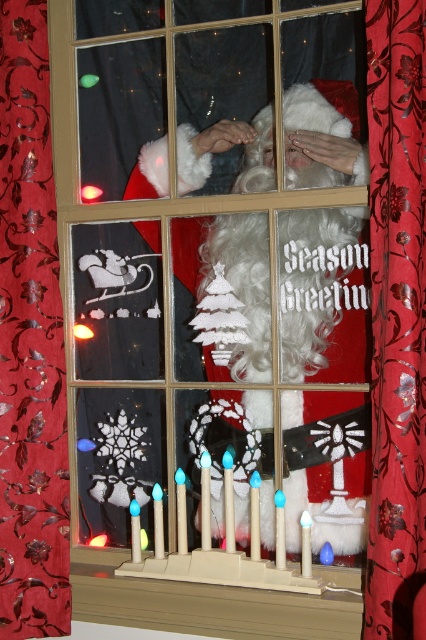
Does red floral fabric curtain at left have a lesser width compared to red velvet curtain at center?

No.

Who is positioned more to the right, red floral fabric curtain at left or red velvet curtain at center?

From the viewer's perspective, red velvet curtain at center appears more on the right side.

Is point (13, 164) positioned in front of point (409, 275)?

That is False.

Locate an element on the screen. Image resolution: width=426 pixels, height=640 pixels. red floral fabric curtain at left is located at coordinates (29, 340).

Is red velvet curtain at center below beige wood at lower center?

No.

Does point (412, 506) come behind point (238, 634)?

No.

Find the location of a particular element. red velvet curtain at center is located at coordinates (397, 317).

Is red floral fabric curtain at left smaller than beige wood at lower center?

Correct, red floral fabric curtain at left occupies less space than beige wood at lower center.

Based on the photo, who is shorter, red floral fabric curtain at left or beige wood at lower center?

beige wood at lower center

Does point (20, 282) lie in front of point (310, 632)?

No, (20, 282) is behind (310, 632).

Locate an element on the screen. red floral fabric curtain at left is located at coordinates (29, 340).